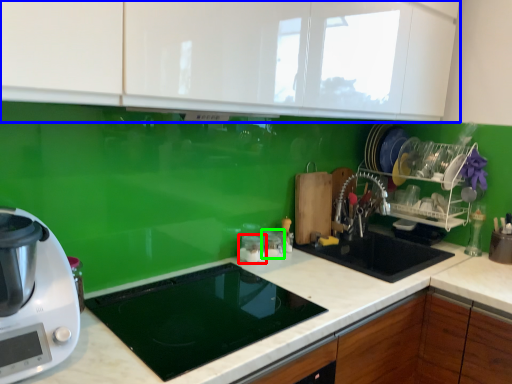
Question: Which is nearer to the appliance (highlighted by a red box)? cabinetry (highlighted by a blue box) or appliance (highlighted by a green box).

Choices:
 (A) cabinetry
 (B) appliance

Answer: (B)